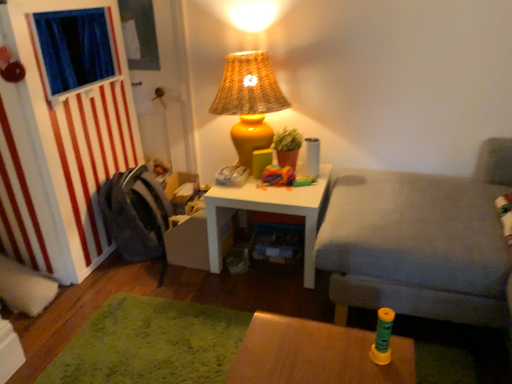
Locate an element on the screen. This screenshot has width=512, height=384. free point above wooden table at lower center, the first table when ordered from front to back (from a real-world perspective) is located at coordinates (322, 351).